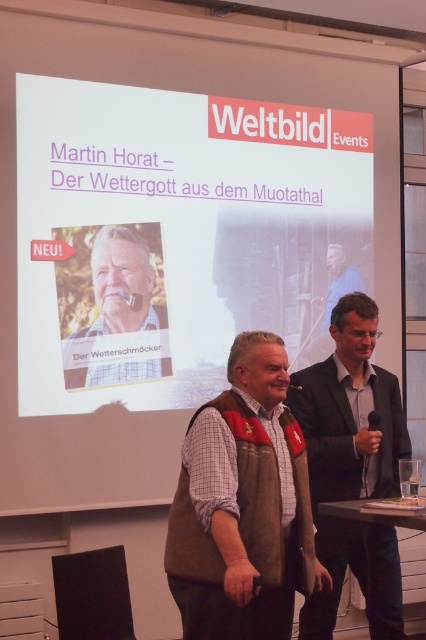
In the scene shown: Which is below, white matte projection screen at upper center or dark gray suit at center?

dark gray suit at center

How much distance is there between white matte projection screen at upper center and dark gray suit at center?

A distance of 1.45 meters exists between white matte projection screen at upper center and dark gray suit at center.

Does point (164, 314) come farther from viewer compared to point (334, 528)?

Yes, point (164, 314) is behind point (334, 528).

You are a GUI agent. You are given a task and a screenshot of the screen. Output one action in this format:
    pyautogui.click(x=<x>, y=<y>)
    Task: Click on the white matte projection screen at upper center
    The height and width of the screenshot is (640, 426).
    Given the screenshot: What is the action you would take?
    pyautogui.click(x=176, y=236)

Between white matte projection screen at upper center and matte brown vest at center, which one is positioned higher?

white matte projection screen at upper center is higher up.

Is the position of white matte projection screen at upper center less distant than that of matte brown vest at center?

Yes, it is.

Where is `white matte projection screen at upper center`? The image size is (426, 640). white matte projection screen at upper center is located at coordinates (176, 236).

Who is more forward, (x=94, y=164) or (x=353, y=275)?

Point (x=94, y=164)

Is point (92, 394) closer to viewer compared to point (347, 268)?

That is True.

In order to click on white matte projection screen at upper center in this screenshot , I will do `click(176, 236)`.